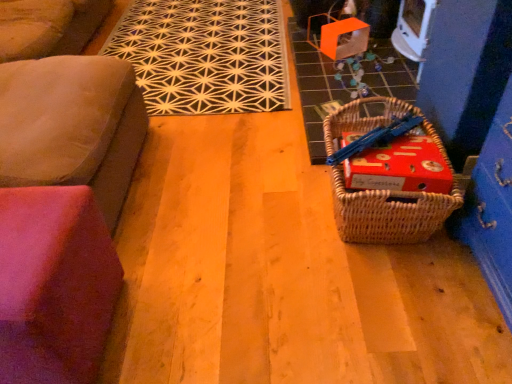
In order to click on free space to the left of woven brown picnic basket at lower right in this screenshot , I will do `click(270, 209)`.